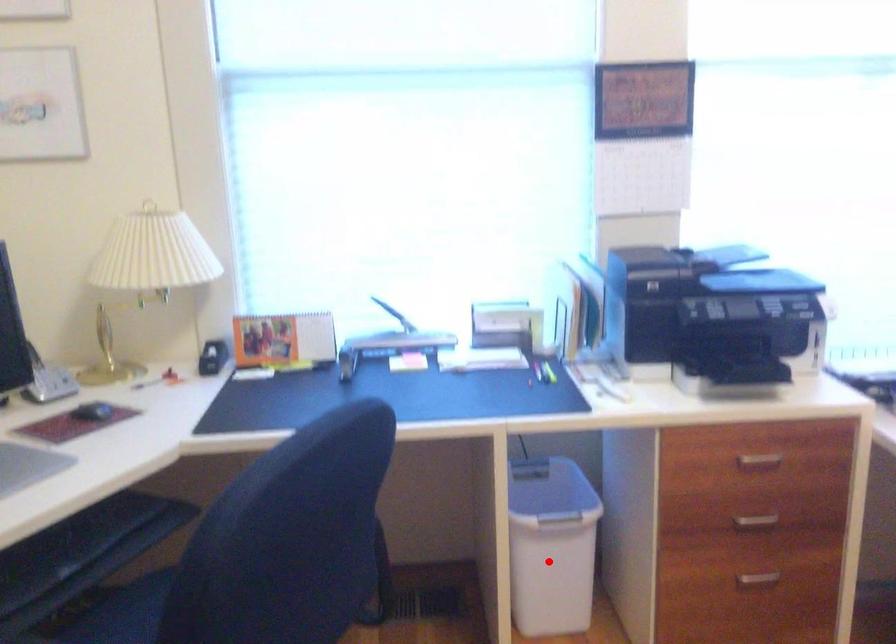
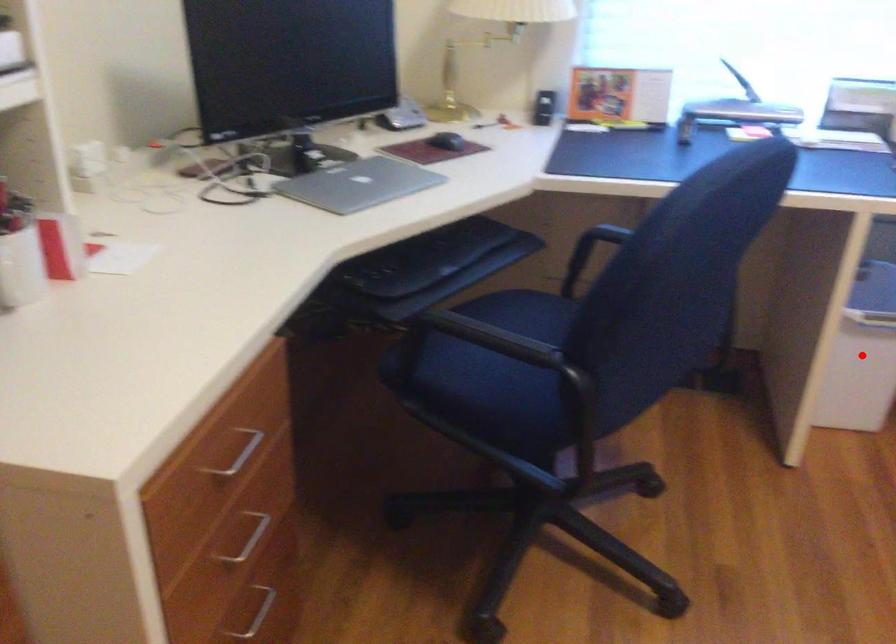
I am providing you with two images of the same scene from different viewpoints. A red point is marked on the first image and another point is marked on the second image. Do the highlighted points in image1 and image2 indicate the same real-world spot?

Yes